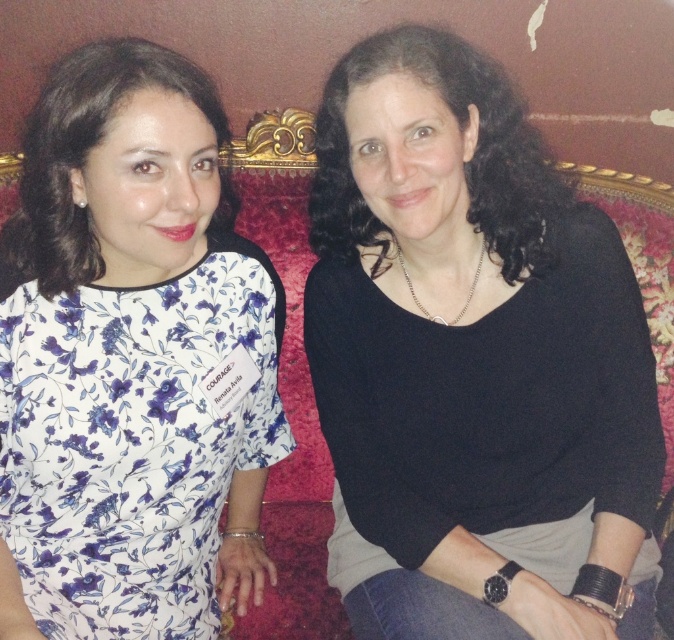
Question: Which of the following is the closest to the observer?

Choices:
 (A) black matte sweater at center
 (B) floral print fabric dress at left

Answer: (A)

Question: Is black matte sweater at center above floral print fabric dress at left?

Choices:
 (A) yes
 (B) no

Answer: (A)

Question: Considering the relative positions of black matte sweater at center and floral print fabric dress at left in the image provided, where is black matte sweater at center located with respect to floral print fabric dress at left?

Choices:
 (A) left
 (B) right

Answer: (B)

Question: Which object is farther from the camera taking this photo?

Choices:
 (A) black matte sweater at center
 (B) floral print fabric dress at left

Answer: (B)

Question: Is black matte sweater at center positioned behind floral print fabric dress at left?

Choices:
 (A) no
 (B) yes

Answer: (A)